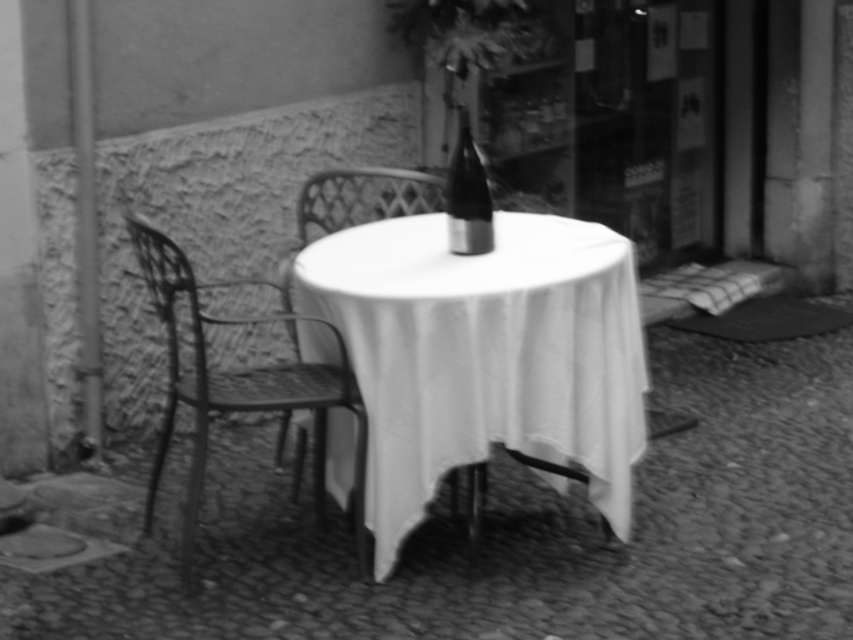
Does metallic wire chair at left have a lesser width compared to metallic mesh chair at center?

No.

Locate an element on the screen. metallic wire chair at left is located at coordinates (241, 385).

Describe the element at coordinates (241, 385) in the screenshot. This screenshot has width=853, height=640. I see `metallic wire chair at left` at that location.

Is point (300, 314) positioned behind point (473, 240)?

Yes, point (300, 314) is farther from viewer.

Image resolution: width=853 pixels, height=640 pixels. Identify the location of metallic wire chair at left. (241, 385).

Between metallic mesh chair at center and smooth glass bottle at center, which one has less height?

metallic mesh chair at center is shorter.

Is metallic mesh chair at center further to the viewer compared to smooth glass bottle at center?

That is True.

Locate an element on the screen. metallic mesh chair at center is located at coordinates (363, 196).

Where is `metallic mesh chair at center`? Image resolution: width=853 pixels, height=640 pixels. metallic mesh chair at center is located at coordinates (363, 196).